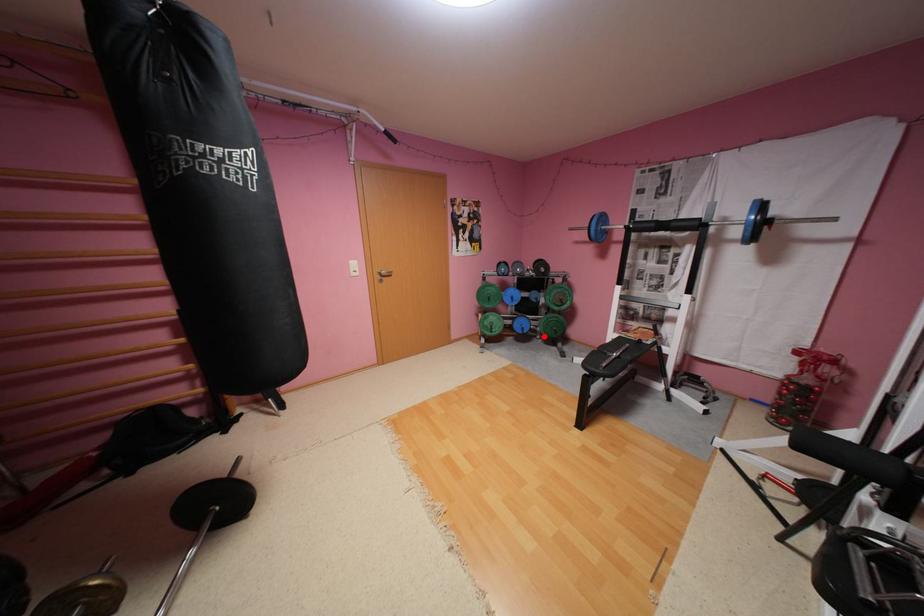
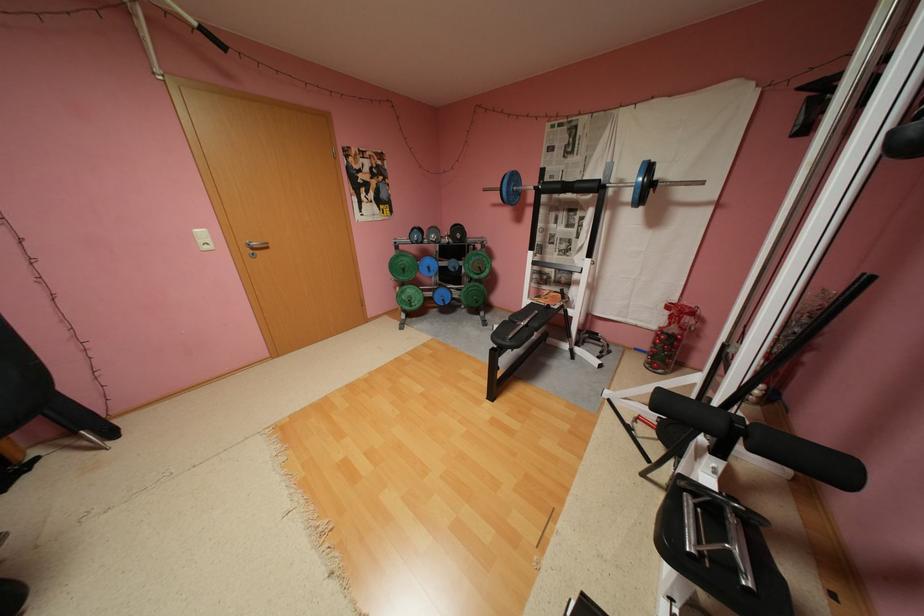
The point at the highlighted location is marked in the first image. Where is the corresponding point in the second image?

(468, 306)